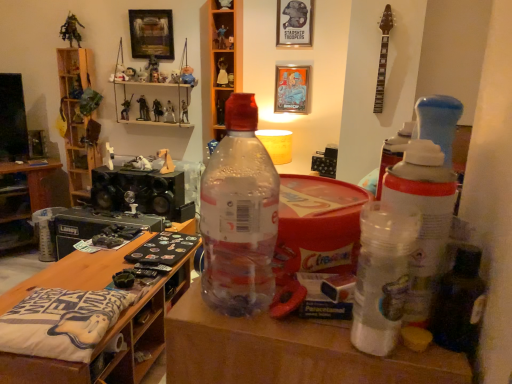
Question: Is plastic toy soldier at upper center, the 1th toy positioned from the right, further to camera compared to white plastic figurine at upper center, positioned as the 14th toy in left-to-right order?

Choices:
 (A) no
 (B) yes

Answer: (A)

Question: Can you confirm if plastic toy soldier at upper center, the eighteenth toy in the left-to-right sequence, is wider than white plastic figurine at upper center, arranged as the 5th toy when viewed from the right?

Choices:
 (A) no
 (B) yes

Answer: (A)

Question: From the image's perspective, is plastic toy soldier at upper center, the 1th toy positioned from the right, below white plastic figurine at upper center, arranged as the 5th toy when viewed from the right?

Choices:
 (A) no
 (B) yes

Answer: (A)

Question: Could you tell me if plastic toy soldier at upper center, the 1th toy positioned from the right, is facing white plastic figurine at upper center, arranged as the 5th toy when viewed from the right?

Choices:
 (A) yes
 (B) no

Answer: (B)

Question: Does plastic toy soldier at upper center, the eighteenth toy in the left-to-right sequence, have a larger size compared to white plastic figurine at upper center, positioned as the 14th toy in left-to-right order?

Choices:
 (A) no
 (B) yes

Answer: (A)

Question: Is point (225, 8) closer or farther from the camera than point (141, 117)?

Choices:
 (A) closer
 (B) farther

Answer: (A)

Question: Considering the positions of metallic silver figurine at upper center, the second toy viewed from the right, and shiny black figurine at upper center, acting as the 4th toy starting from the left, in the image, is metallic silver figurine at upper center, the second toy viewed from the right, wider or thinner than shiny black figurine at upper center, acting as the 4th toy starting from the left,?

Choices:
 (A) thin
 (B) wide

Answer: (B)

Question: Based on their positions, is metallic silver figurine at upper center, the 17th toy from the left, located to the left or right of shiny black figurine at upper center, which appears as the 15th toy when viewed from the right?

Choices:
 (A) left
 (B) right

Answer: (B)

Question: From a real-world perspective, is metallic silver figurine at upper center, the 17th toy from the left, above or below shiny black figurine at upper center, which appears as the 15th toy when viewed from the right?

Choices:
 (A) above
 (B) below

Answer: (A)

Question: Is plush toy at upper center, which appears as the 3th toy when viewed from the left, wider or thinner than plastic figurines at upper center, which ranks as the twelfth toy in right-to-left order?

Choices:
 (A) wide
 (B) thin

Answer: (B)

Question: From the image's perspective, is plush toy at upper center, arranged as the 16th toy when viewed from the right, located above or below plastic figurines at upper center, which ranks as the twelfth toy in right-to-left order?

Choices:
 (A) below
 (B) above

Answer: (B)

Question: Relative to plastic figurines at upper center, which ranks as the twelfth toy in right-to-left order, is plush toy at upper center, which appears as the 3th toy when viewed from the left, in front or behind?

Choices:
 (A) front
 (B) behind

Answer: (B)

Question: Based on their sizes in the image, would you say plush toy at upper center, arranged as the 16th toy when viewed from the right, is bigger or smaller than plastic figurines at upper center, arranged as the seventh toy when viewed from the left?

Choices:
 (A) big
 (B) small

Answer: (B)

Question: Is point (156, 112) closer or farther from the camera than point (145, 84)?

Choices:
 (A) farther
 (B) closer

Answer: (A)

Question: Would you say metallic figure at shelf center, the eleventh toy positioned from the right, is inside or outside plastic figurines at upper center, which ranks as the twelfth toy in right-to-left order?

Choices:
 (A) inside
 (B) outside

Answer: (A)